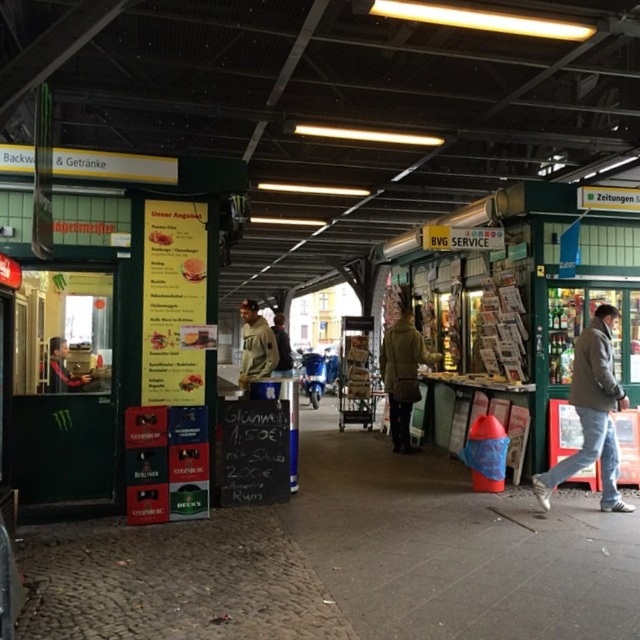
Question: Is light brown leather jacket at lower right to the left of khaki cotton jacket at center from the viewer's perspective?

Choices:
 (A) yes
 (B) no

Answer: (B)

Question: Among these objects, which one is farthest from the camera?

Choices:
 (A) light brown leather jacket at lower right
 (B) light brown leather jacket at center
 (C) khaki cotton jacket at center
 (D) green wool coat at center

Answer: (C)

Question: Is light brown leather jacket at lower right wider than khaki cotton jacket at center?

Choices:
 (A) no
 (B) yes

Answer: (B)

Question: Among these objects, which one is nearest to the camera?

Choices:
 (A) matte black jacket at left
 (B) light brown leather jacket at center
 (C) light brown leather jacket at lower right
 (D) khaki cotton jacket at center

Answer: (C)

Question: Is light brown leather jacket at lower right smaller than green wool coat at center?

Choices:
 (A) yes
 (B) no

Answer: (A)

Question: Which point is closer to the camera taking this photo?

Choices:
 (A) (273, 368)
 (B) (417, 340)
 (C) (67, 387)
 (D) (573, 352)

Answer: (C)